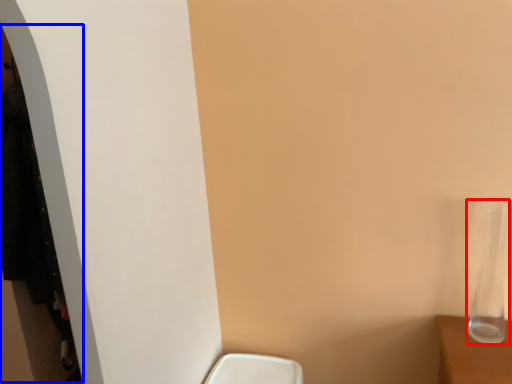
Question: Which point is closer to the camera, glass vase (highlighted by a red box) or closet (highlighted by a blue box)?

Choices:
 (A) glass vase
 (B) closet

Answer: (A)